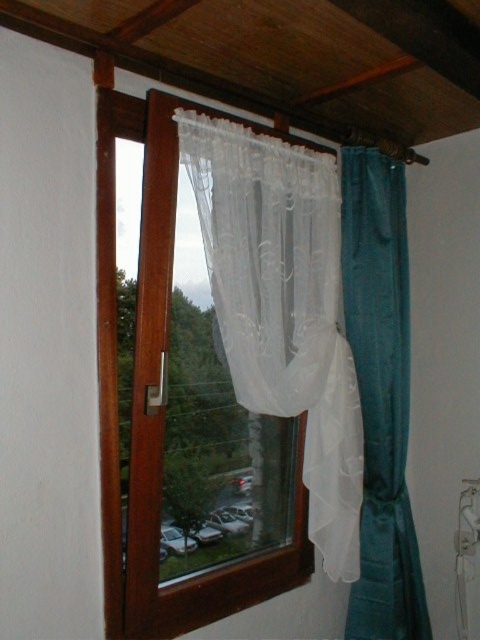
Consider the image. Can you confirm if white sheer curtain at center is thinner than transparent plastic window at center?

Yes, white sheer curtain at center is thinner than transparent plastic window at center.

Between point (330, 392) and point (147, 147), which one is positioned in front?

Point (147, 147)

Between point (235, 292) and point (157, 262), which one is positioned in front?

Point (157, 262) is in front.

At what (x,y) coordinates should I click in order to perform the action: click on white sheer curtain at center. Please return your answer as a coordinate pair (x, y). This screenshot has width=480, height=640. Looking at the image, I should click on (284, 307).

Can you confirm if white sheer curtain at center is smaller than teal satin curtain at right?

No, white sheer curtain at center is not smaller than teal satin curtain at right.

Does white sheer curtain at center appear over teal satin curtain at right?

Indeed, white sheer curtain at center is positioned over teal satin curtain at right.

I want to click on white sheer curtain at center, so click(x=284, y=307).

At what (x,y) coordinates should I click in order to perform the action: click on white sheer curtain at center. Please return your answer as a coordinate pair (x, y). Looking at the image, I should click on (284, 307).

Does transparent plastic window at center have a lesser height compared to teal satin curtain at right?

Yes, transparent plastic window at center is shorter than teal satin curtain at right.

At what (x,y) coordinates should I click in order to perform the action: click on transparent plastic window at center. Please return your answer as a coordinate pair (x, y). The width and height of the screenshot is (480, 640). Looking at the image, I should click on (158, 408).

Is point (218, 580) farther from camera compared to point (388, 164)?

No.

Where is `transparent plastic window at center`? Image resolution: width=480 pixels, height=640 pixels. transparent plastic window at center is located at coordinates (158, 408).